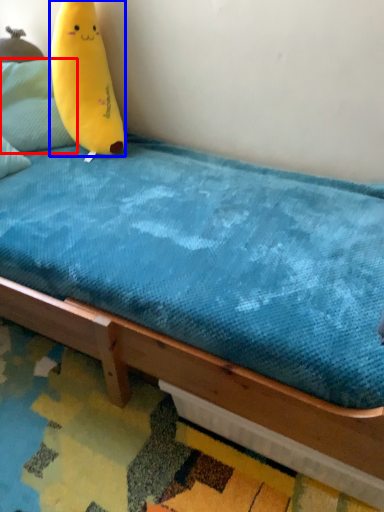
Question: Which of the following is the farthest to the observer, pillow (highlighted by a red box) or banana (highlighted by a blue box)?

Choices:
 (A) pillow
 (B) banana

Answer: (A)